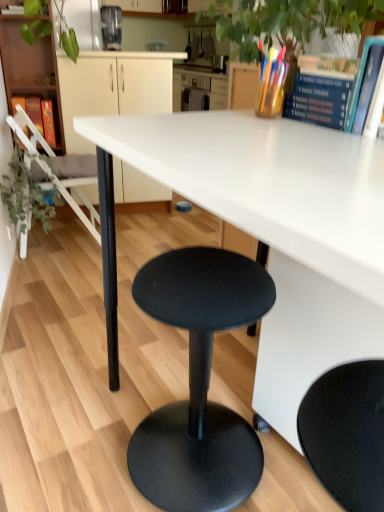
Question: Would you say matte wood bookshelf at left is to the left or to the right of white plastic chair at left in the picture?

Choices:
 (A) right
 (B) left

Answer: (B)

Question: Considering the positions of matte wood bookshelf at left and white plastic chair at left in the image, is matte wood bookshelf at left wider or thinner than white plastic chair at left?

Choices:
 (A) wide
 (B) thin

Answer: (B)

Question: Estimate the real-world distances between objects in this image. Which object is farther from the blue hardcover book at upper right, positioned as the 2th book in right-to-left order?

Choices:
 (A) white plastic chair at left
 (B) satin silver coffee maker at upper left, placed as the 1th appliance when sorted from left to right
 (C) hardcover book at left, which is the 3th book from front to back
 (D) metallic gray coffee machine at upper center, the first appliance in the right-to-left sequence
 (E) green leafy plant at left

Answer: (D)

Question: Which of these objects is positioned closest to the hardcover book at left, which is the 3th book from front to back?

Choices:
 (A) blue hardcover book at upper right, positioned as the 2th book in right-to-left order
 (B) white plastic chair at left
 (C) green leafy plant at left
 (D) metallic gray coffee machine at upper center, the first appliance in the right-to-left sequence
 (E) white matte desk at center

Answer: (B)